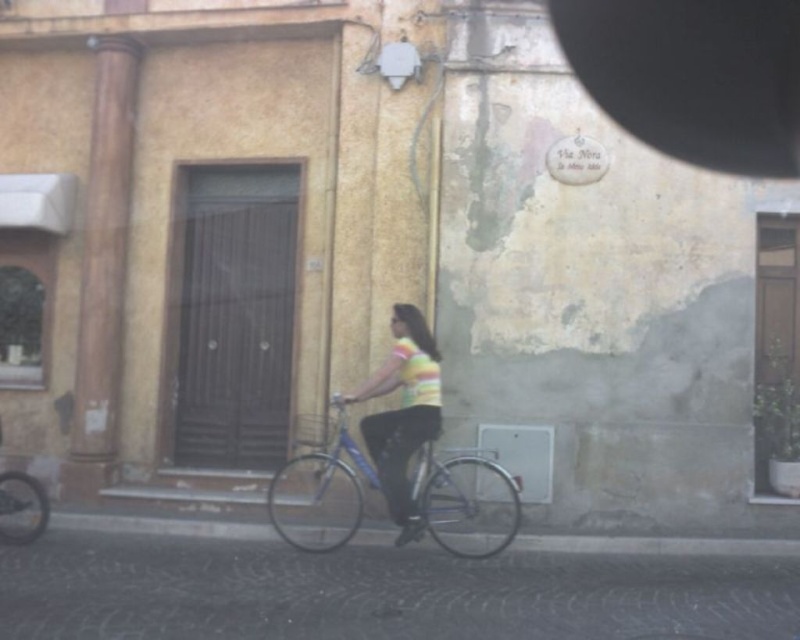
Which of these two, blue metallic bicycle at center or striped fabric shirt at center, stands shorter?

blue metallic bicycle at center is shorter.

Locate an element on the screen. blue metallic bicycle at center is located at coordinates (320, 493).